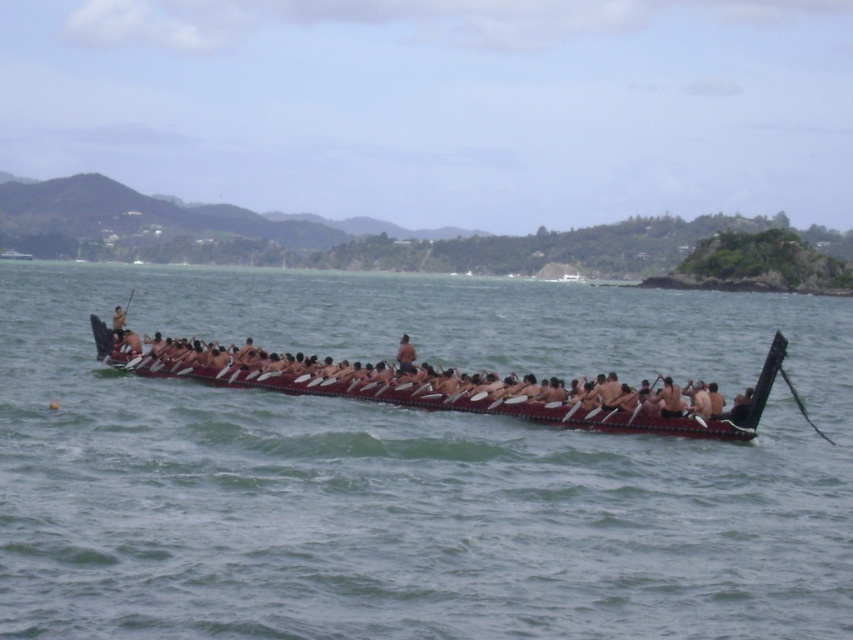
Question: Which point appears closest to the camera in this image?

Choices:
 (A) (155, 401)
 (B) (231, 380)
 (C) (575, 401)

Answer: (C)

Question: Is brown wooden canoe at center further to the viewer compared to polished dark wood canoe at center?

Choices:
 (A) yes
 (B) no

Answer: (B)

Question: Among these points, which one is farthest from the camera?

Choices:
 (A) (486, 394)
 (B) (259, 333)

Answer: (B)

Question: Which of the following is the closest to the observer?

Choices:
 (A) wooden polished paddle at center
 (B) polished dark wood canoe at center
 (C) brown wooden canoe at center

Answer: (C)

Question: Is brown wooden canoe at center below polished dark wood canoe at center?

Choices:
 (A) no
 (B) yes

Answer: (A)

Question: Considering the relative positions of brown wooden canoe at center and wooden polished paddle at center in the image provided, where is brown wooden canoe at center located with respect to wooden polished paddle at center?

Choices:
 (A) above
 (B) below

Answer: (A)